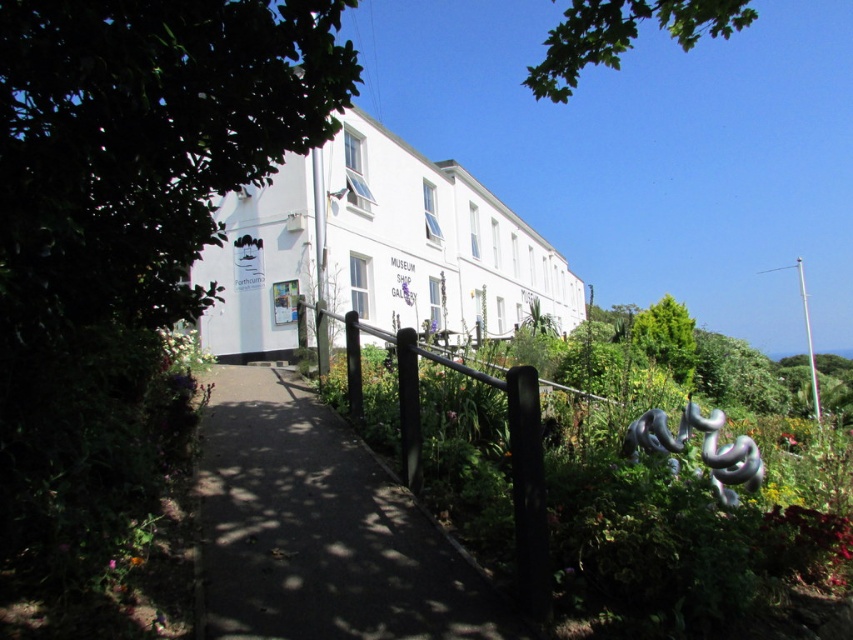
The image size is (853, 640). What do you see at coordinates (589, 497) in the screenshot?
I see `metallic sculpture at center-right` at bounding box center [589, 497].

Between metallic sculpture at center-right and dark gray asphalt at center, which one is positioned higher?

Positioned higher is metallic sculpture at center-right.

Which is behind, point (532, 540) or point (207, 604)?

The point (532, 540) is more distant.

I want to click on metallic sculpture at center-right, so click(x=589, y=497).